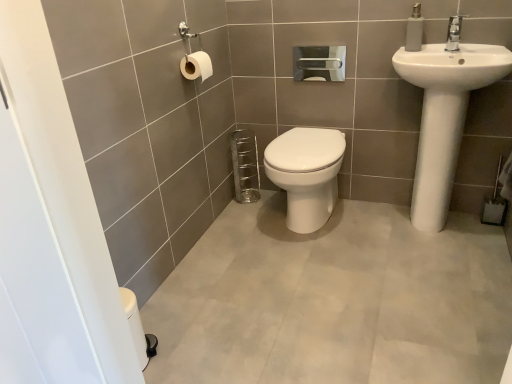
The height and width of the screenshot is (384, 512). I want to click on vacant area that lies to the right of white ceramic faucet at upper right, so click(478, 44).